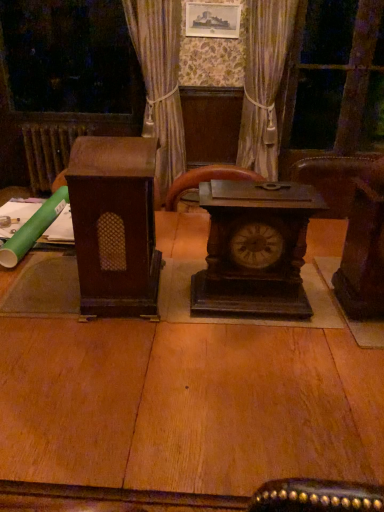
Where is `vacant area that lies between dark wood chair at right, which is counted as the second furniture, starting from the left, and dark brown wood clock at center`? This screenshot has width=384, height=512. vacant area that lies between dark wood chair at right, which is counted as the second furniture, starting from the left, and dark brown wood clock at center is located at coordinates (322, 302).